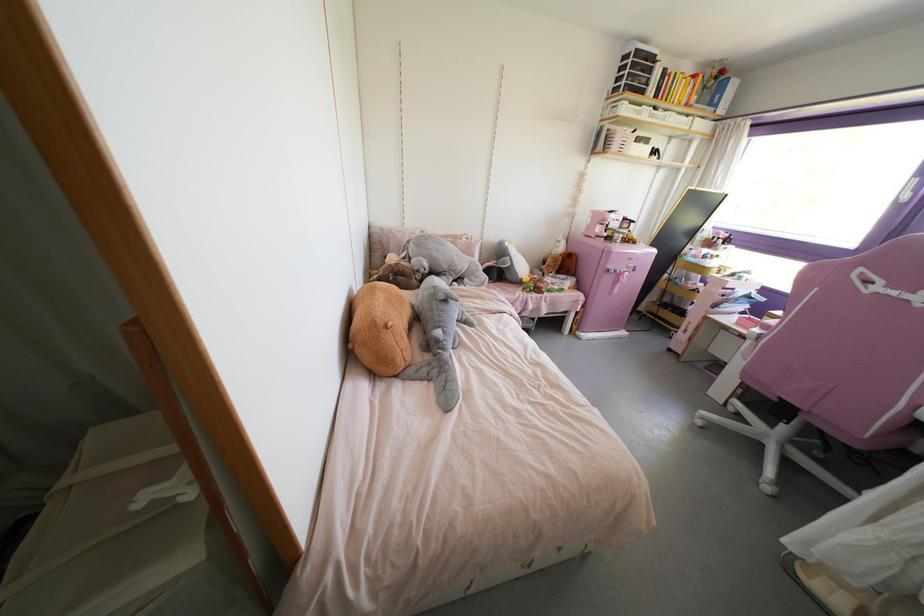
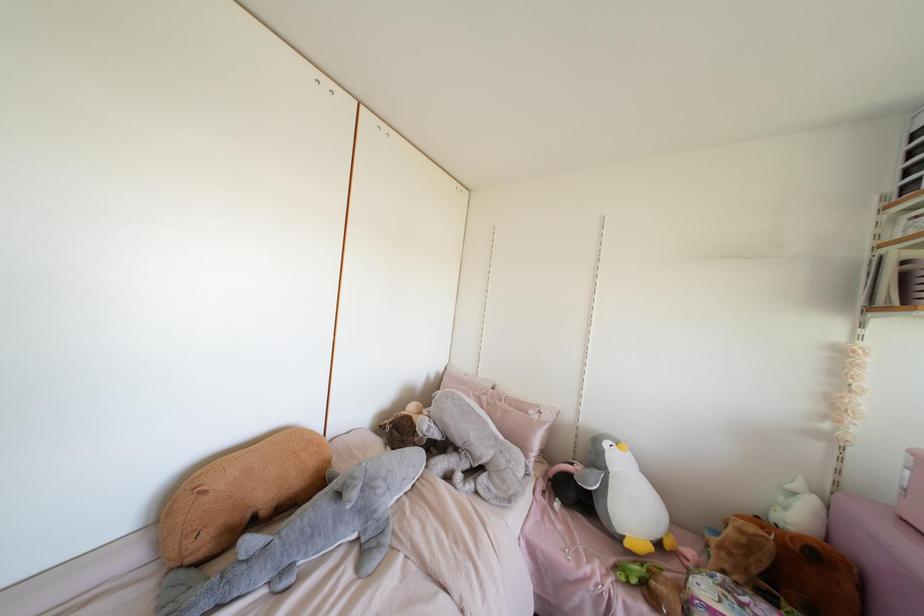
Where in the second image is the point corresponding to pixel 591 152 from the first image?

(870, 307)